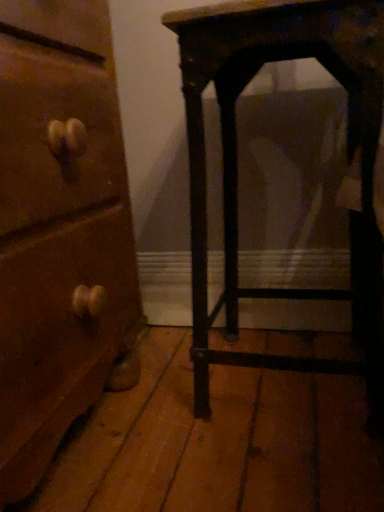
Question: Does dark wood table at right have a greater width compared to wooden chest of drawers at left?

Choices:
 (A) no
 (B) yes

Answer: (A)

Question: Considering the relative sizes of dark wood table at right and wooden chest of drawers at left in the image provided, is dark wood table at right thinner than wooden chest of drawers at left?

Choices:
 (A) yes
 (B) no

Answer: (A)

Question: Is dark wood table at right far from wooden chest of drawers at left?

Choices:
 (A) no
 (B) yes

Answer: (A)

Question: From a real-world perspective, is dark wood table at right on wooden chest of drawers at left?

Choices:
 (A) no
 (B) yes

Answer: (A)

Question: Is dark wood table at right facing away from wooden chest of drawers at left?

Choices:
 (A) yes
 (B) no

Answer: (B)

Question: Is dark wood table at right shorter than wooden chest of drawers at left?

Choices:
 (A) no
 (B) yes

Answer: (B)

Question: Considering the relative sizes of wooden chest of drawers at left and dark wood table at right in the image provided, is wooden chest of drawers at left wider than dark wood table at right?

Choices:
 (A) no
 (B) yes

Answer: (B)

Question: From a real-world perspective, is wooden chest of drawers at left under dark wood table at right?

Choices:
 (A) no
 (B) yes

Answer: (A)

Question: Is wooden chest of drawers at left positioned beyond the bounds of dark wood table at right?

Choices:
 (A) no
 (B) yes

Answer: (B)

Question: Is wooden chest of drawers at left facing towards dark wood table at right?

Choices:
 (A) yes
 (B) no

Answer: (A)

Question: Is dark wood table at right inside wooden chest of drawers at left?

Choices:
 (A) no
 (B) yes

Answer: (A)

Question: Would you consider wooden chest of drawers at left to be distant from dark wood table at right?

Choices:
 (A) yes
 (B) no

Answer: (B)

Question: From the image's perspective, relative to wooden chest of drawers at left, is dark wood table at right above or below?

Choices:
 (A) below
 (B) above

Answer: (B)